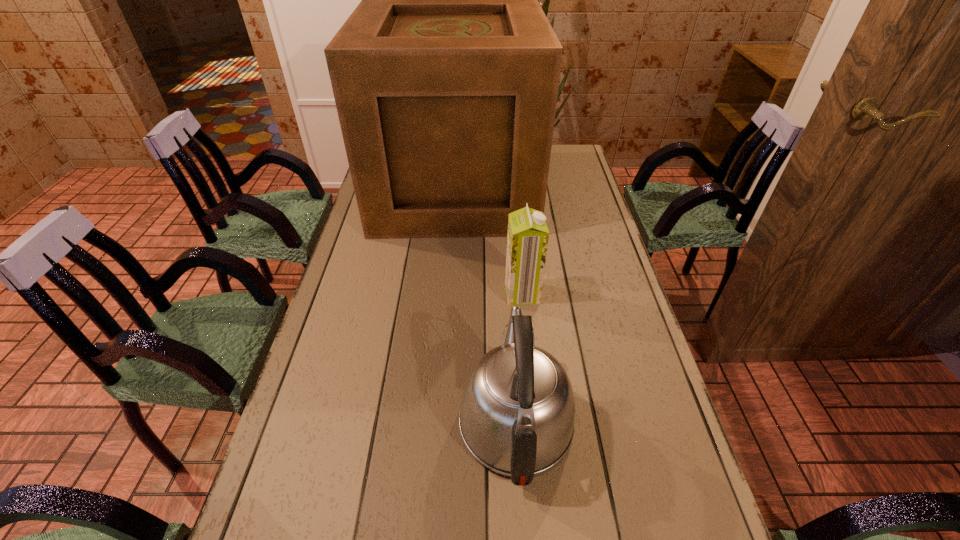
In order to click on the tallest object in this screenshot , I will do `click(445, 77)`.

This screenshot has height=540, width=960. I want to click on box, so click(445, 77).

Find the location of `kettle`. kettle is located at coordinates (517, 413).

At what (x,y) coordinates should I click in order to perform the action: click on the second nearest object. Please return your answer as a coordinate pair (x, y). The height and width of the screenshot is (540, 960). Looking at the image, I should click on (527, 240).

Where is `free region located on the right of the box`? The image size is (960, 540). free region located on the right of the box is located at coordinates (573, 191).

This screenshot has width=960, height=540. I want to click on vacant region located on the spout of the kettle, so (509, 312).

The image size is (960, 540). What are the coordinates of `free space located on the spout of the kettle` in the screenshot? It's located at (506, 271).

Locate an element on the screen. free spot located on the spout of the kettle is located at coordinates (508, 299).

Locate an element on the screen. free space located 0.140m on the left of the second nearest object is located at coordinates (457, 293).

Where is `object present at the far edge`? object present at the far edge is located at coordinates (445, 77).